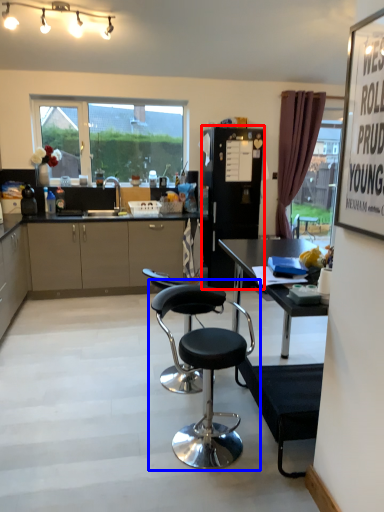
Question: Which of the following is the closest to the observer, appliance (highlighted by a red box) or chair (highlighted by a blue box)?

Choices:
 (A) appliance
 (B) chair

Answer: (B)